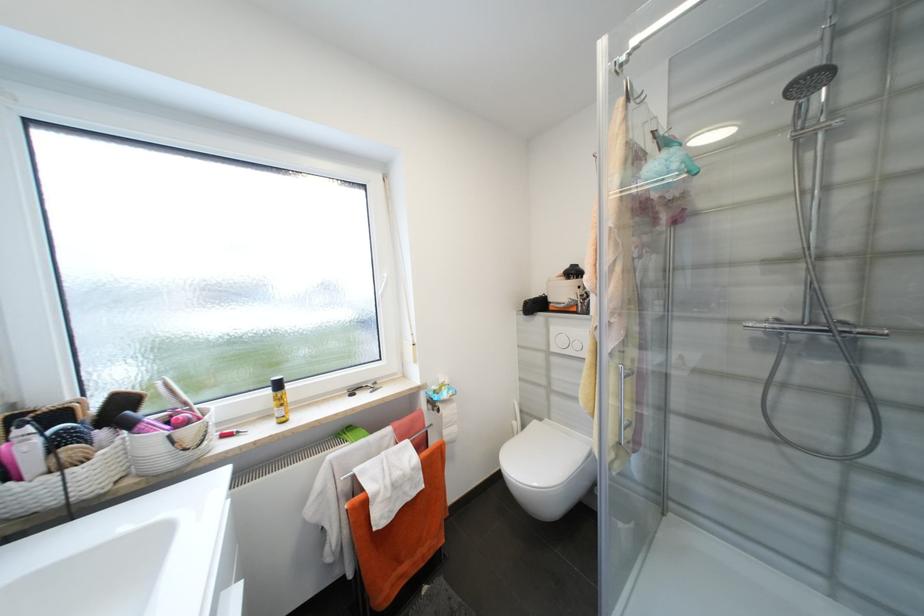
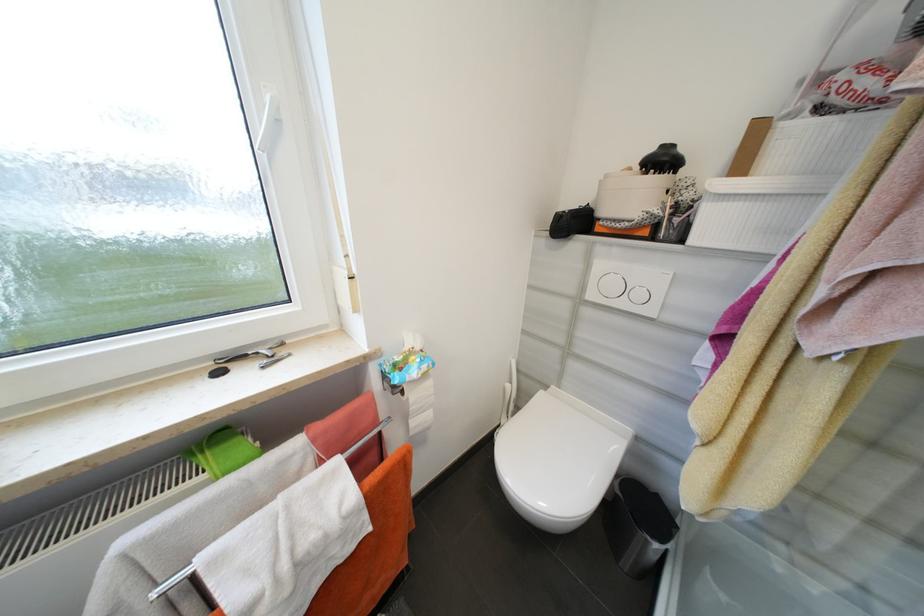
Question: The images are taken continuously from a first-person perspective. In which direction are you moving?

Choices:
 (A) Left
 (B) Right
 (C) Forward
 (D) Backward

Answer: (C)